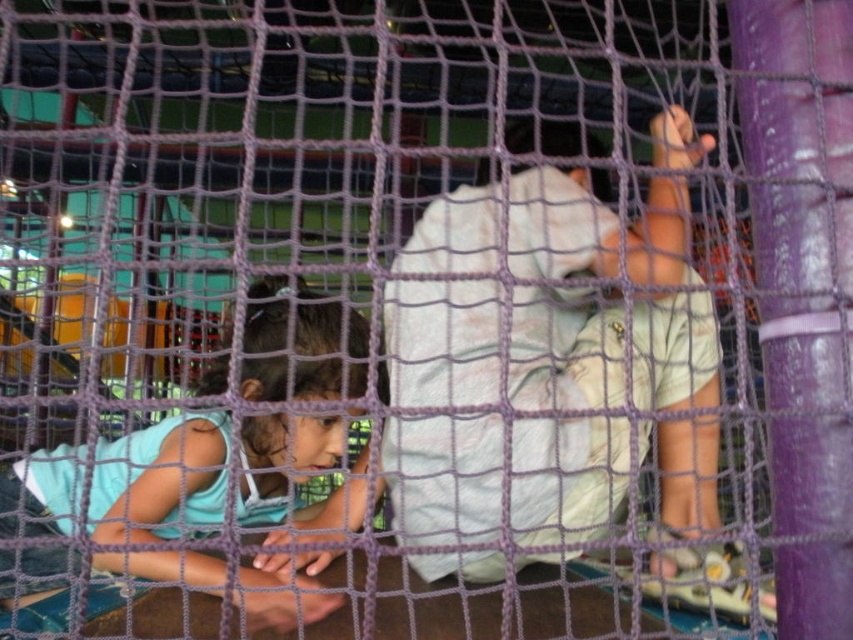
You are standing in the play area and see the purple netting structure in the foreground. There is a point marked at coordinates (538, 349). What object is located at that point?

The point (538, 349) indicates the location of the white cotton shirt at center.

You are a parent trying to locate your child in the play area. You see the white cotton shirt at center and the light blue fabric at lower left. Which one is positioned to the right side of the other?

The white cotton shirt at center is to the right of the light blue fabric at lower left.